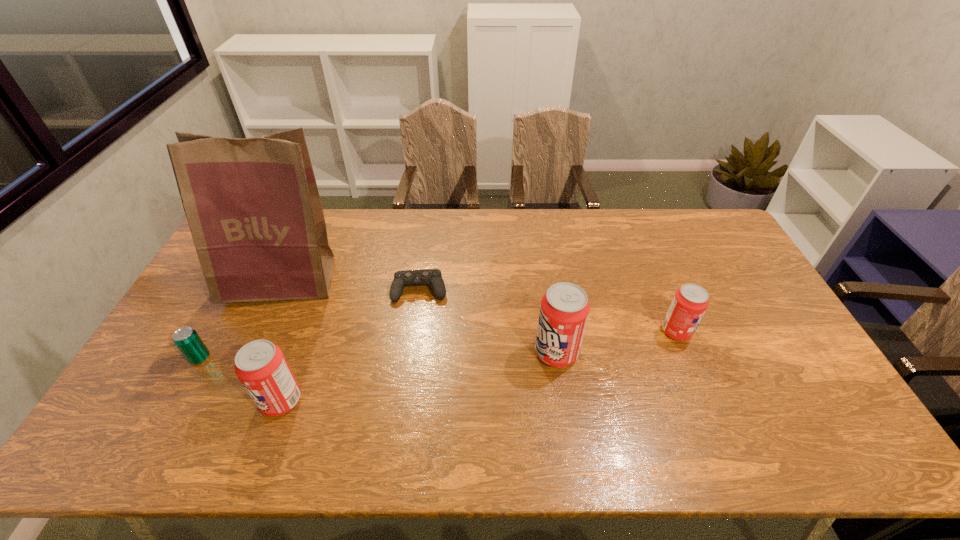
You are a GUI agent. You are given a task and a screenshot of the screen. Output one action in this format:
    pyautogui.click(x=<x>, y=<y>)
    Task: Click on the free location that satisfies the following two spatial constraints: 1. on the back side of the fifth tallest object; 2. on the right side of the third object from right to left
    This screenshot has height=540, width=960.
    Given the screenshot: What is the action you would take?
    pyautogui.click(x=237, y=290)

You are a GUI agent. You are given a task and a screenshot of the screen. Output one action in this format:
    pyautogui.click(x=<x>, y=<y>)
    Task: Click on the free space that satisfies the following two spatial constraints: 1. on the front side of the third object from right to left; 2. on the surface of the nearest soda can
    This screenshot has height=540, width=960.
    Given the screenshot: What is the action you would take?
    pyautogui.click(x=404, y=401)